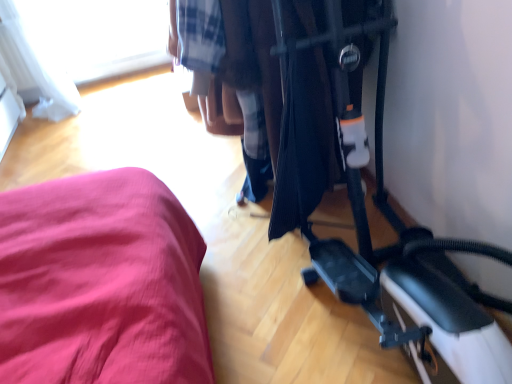
Question: Choose the correct answer: Is transparent glass window at upper left inside black plastic baby carriage at center or outside it?

Choices:
 (A) inside
 (B) outside

Answer: (B)

Question: From the image's perspective, is transparent glass window at upper left above or below black plastic baby carriage at center?

Choices:
 (A) below
 (B) above

Answer: (B)

Question: Considering their positions, is transparent glass window at upper left located in front of or behind black plastic baby carriage at center?

Choices:
 (A) behind
 (B) front

Answer: (A)

Question: Is black plastic baby carriage at center to the left or to the right of transparent glass window at upper left in the image?

Choices:
 (A) right
 (B) left

Answer: (A)

Question: In terms of width, does black plastic baby carriage at center look wider or thinner when compared to transparent glass window at upper left?

Choices:
 (A) wide
 (B) thin

Answer: (A)

Question: Is point (348, 94) positioned closer to the camera than point (74, 18)?

Choices:
 (A) farther
 (B) closer

Answer: (B)

Question: Considering their positions, is black plastic baby carriage at center located in front of or behind transparent glass window at upper left?

Choices:
 (A) behind
 (B) front

Answer: (B)